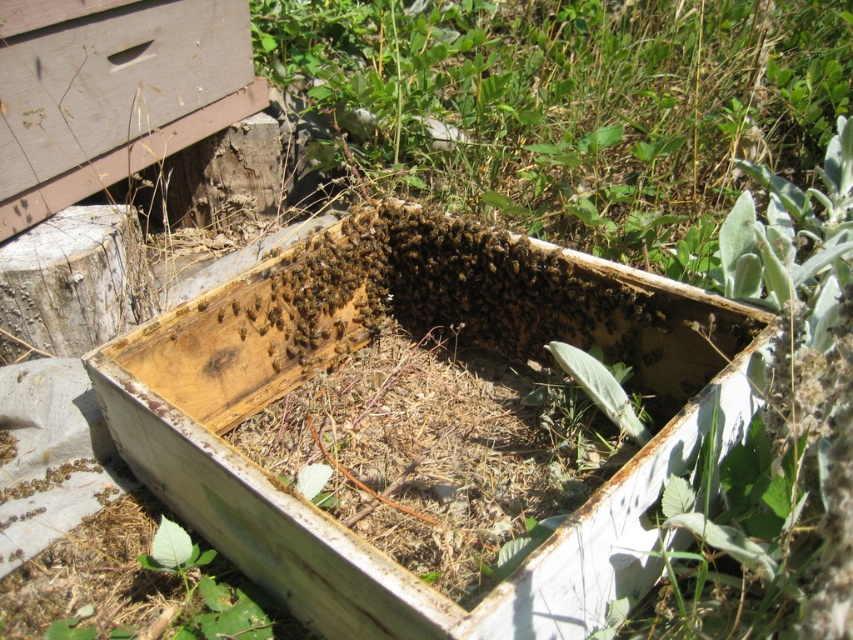
Which is above, weathered wood beehive at center or translucent yellowish honeycomb at center?

translucent yellowish honeycomb at center is above.

Is weathered wood beehive at center taller than translucent yellowish honeycomb at center?

Yes, weathered wood beehive at center is taller than translucent yellowish honeycomb at center.

Does point (283, 326) come behind point (223, 307)?

Yes, it is.

Image resolution: width=853 pixels, height=640 pixels. In order to click on weathered wood beehive at center in this screenshot , I will do `click(416, 330)`.